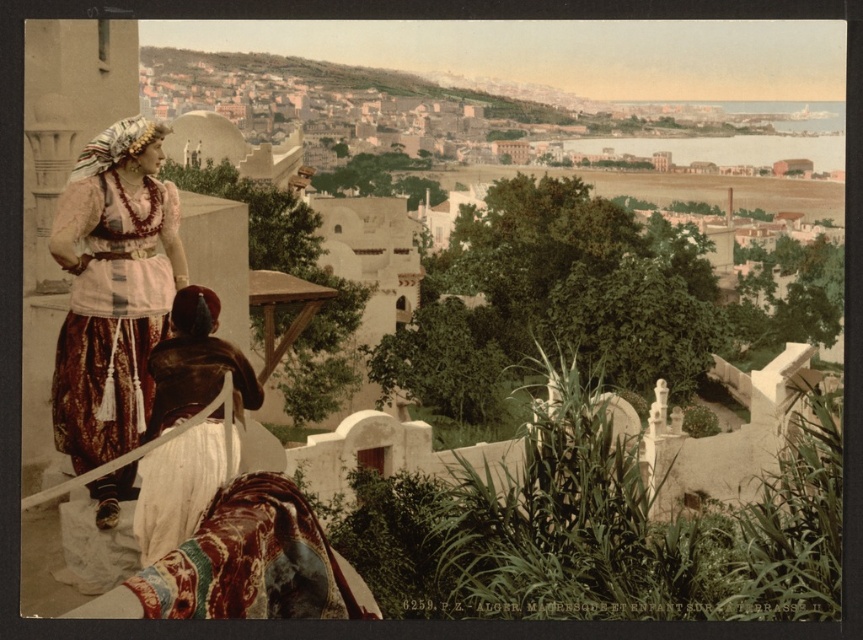
Does matte brown dress at left have a lesser height compared to brown leather dress at center?

Incorrect, matte brown dress at left's height does not fall short of brown leather dress at center's.

Can you confirm if matte brown dress at left is positioned below brown leather dress at center?

Incorrect, matte brown dress at left is not positioned below brown leather dress at center.

Does point (106, 496) come in front of point (135, 508)?

No, it is behind (135, 508).

This screenshot has width=863, height=640. I want to click on matte brown dress at left, so click(x=112, y=289).